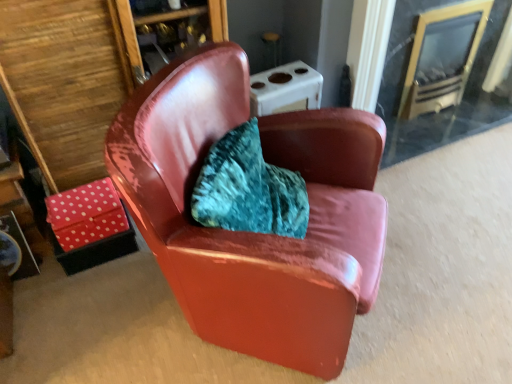
What do you see at coordinates (21, 207) in the screenshot?
I see `polka dot fabric table at lower left` at bounding box center [21, 207].

I want to click on glossy leather chair at center, so click(x=255, y=233).

The width and height of the screenshot is (512, 384). What do you see at coordinates (255, 233) in the screenshot? I see `glossy leather chair at center` at bounding box center [255, 233].

You are a GUI agent. You are given a task and a screenshot of the screen. Output one action in this format:
    pyautogui.click(x=<x>, y=<y>)
    Task: Click on the clear glass fireplace at upper right
    
    Given the screenshot: What is the action you would take?
    pyautogui.click(x=444, y=108)

Is polka dot fabric table at lower left closer to camera compared to glossy leather chair at center?

No, polka dot fabric table at lower left is further to the viewer.

Is polka dot fabric table at lower left facing towards glossy leather chair at center?

No, polka dot fabric table at lower left is not aimed at glossy leather chair at center.

Which of these two, polka dot fabric table at lower left or glossy leather chair at center, is thinner?

With smaller width is polka dot fabric table at lower left.

From a real-world perspective, which object stands above the other?

glossy leather chair at center, from a real-world perspective.

Where is `glass door behind the polka dot fabric table at lower left`? This screenshot has height=384, width=512. glass door behind the polka dot fabric table at lower left is located at coordinates (444, 108).

Considering the relative positions of polka dot fabric table at lower left and clear glass fireplace at upper right in the image provided, is polka dot fabric table at lower left to the left or to the right of clear glass fireplace at upper right?

Based on their positions, polka dot fabric table at lower left is located to the left of clear glass fireplace at upper right.

Do you think polka dot fabric table at lower left is within clear glass fireplace at upper right, or outside of it?

polka dot fabric table at lower left is not enclosed by clear glass fireplace at upper right.

In terms of width, does polka dot fabric table at lower left look wider or thinner when compared to clear glass fireplace at upper right?

polka dot fabric table at lower left is thinner than clear glass fireplace at upper right.

Does clear glass fireplace at upper right have a greater height compared to polka dot fabric table at lower left?

Correct, clear glass fireplace at upper right is much taller as polka dot fabric table at lower left.

Between point (453, 139) and point (15, 166), which one is positioned behind?

The point (453, 139) is farther.

Looking at this image, is clear glass fireplace at upper right in front of polka dot fabric table at lower left?

No, clear glass fireplace at upper right is further to the viewer.

Are clear glass fireplace at upper right and polka dot fabric table at lower left beside each other?

No, clear glass fireplace at upper right is not with polka dot fabric table at lower left.

Is glossy leather chair at center not near clear glass fireplace at upper right?

Yes, glossy leather chair at center is far from clear glass fireplace at upper right.

Considering the relative sizes of glossy leather chair at center and clear glass fireplace at upper right in the image provided, is glossy leather chair at center smaller than clear glass fireplace at upper right?

No, glossy leather chair at center is not smaller than clear glass fireplace at upper right.

From a real-world perspective, is glossy leather chair at center located beneath clear glass fireplace at upper right?

No, from a real-world perspective, glossy leather chair at center is not under clear glass fireplace at upper right.

Looking at this image, what's the angular difference between clear glass fireplace at upper right and glossy leather chair at center's facing directions?

There is a 47-degree angle between the facing directions of clear glass fireplace at upper right and glossy leather chair at center.

Considering their positions, is clear glass fireplace at upper right located in front of or behind glossy leather chair at center?

clear glass fireplace at upper right is behind glossy leather chair at center.

From a real-world perspective, who is located higher, clear glass fireplace at upper right or glossy leather chair at center?

glossy leather chair at center.

From the image's perspective, between clear glass fireplace at upper right and glossy leather chair at center, who is located below?

glossy leather chair at center.

Is glossy leather chair at center smaller than polka dot fabric table at lower left?

No.

How different are the orientations of glossy leather chair at center and polka dot fabric table at lower left in degrees?

46.6 degrees separate the facing orientations of glossy leather chair at center and polka dot fabric table at lower left.

Which is in front, glossy leather chair at center or polka dot fabric table at lower left?

glossy leather chair at center is closer to the camera.

Is glossy leather chair at center not close to polka dot fabric table at lower left?

Absolutely, glossy leather chair at center is distant from polka dot fabric table at lower left.

This screenshot has width=512, height=384. In order to click on table behind the glossy leather chair at center in this screenshot , I will do click(x=21, y=207).

The height and width of the screenshot is (384, 512). What are the coordinates of `table on the left side of clear glass fireplace at upper right` in the screenshot? It's located at (21, 207).

Considering their positions, is clear glass fireplace at upper right positioned closer to glossy leather chair at center than polka dot fabric table at lower left?

Based on the image, polka dot fabric table at lower left appears to be nearer to glossy leather chair at center.

When comparing their distances from polka dot fabric table at lower left, does glossy leather chair at center or clear glass fireplace at upper right seem further?

clear glass fireplace at upper right is positioned further to the anchor polka dot fabric table at lower left.

Estimate the real-world distances between objects in this image. Which object is further from clear glass fireplace at upper right, polka dot fabric table at lower left or glossy leather chair at center?

Based on the image, polka dot fabric table at lower left appears to be further to clear glass fireplace at upper right.

Considering their positions, is glossy leather chair at center positioned further to clear glass fireplace at upper right than polka dot fabric table at lower left?

polka dot fabric table at lower left is further to clear glass fireplace at upper right.

Consider the image. Which object lies nearer to the anchor point polka dot fabric table at lower left, clear glass fireplace at upper right or glossy leather chair at center?

Among the two, glossy leather chair at center is located nearer to polka dot fabric table at lower left.

Which object lies further to the anchor point glossy leather chair at center, polka dot fabric table at lower left or clear glass fireplace at upper right?

clear glass fireplace at upper right is positioned further to the anchor glossy leather chair at center.

At what (x,y) coordinates should I click in order to perform the action: click on chair between polka dot fabric table at lower left and clear glass fireplace at upper right. Please return your answer as a coordinate pair (x, y). This screenshot has height=384, width=512. Looking at the image, I should click on (255, 233).